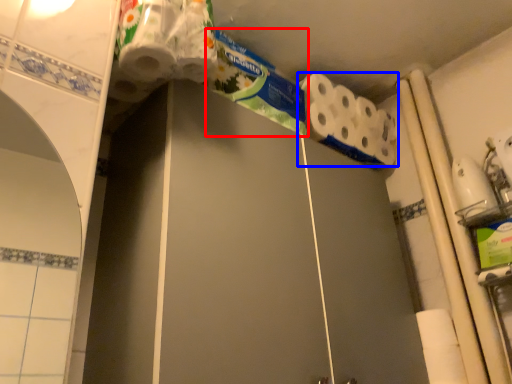
Question: Which of the following is the closest to the observer, toothpaste (highlighted by a red box) or toilet paper (highlighted by a blue box)?

Choices:
 (A) toothpaste
 (B) toilet paper

Answer: (A)